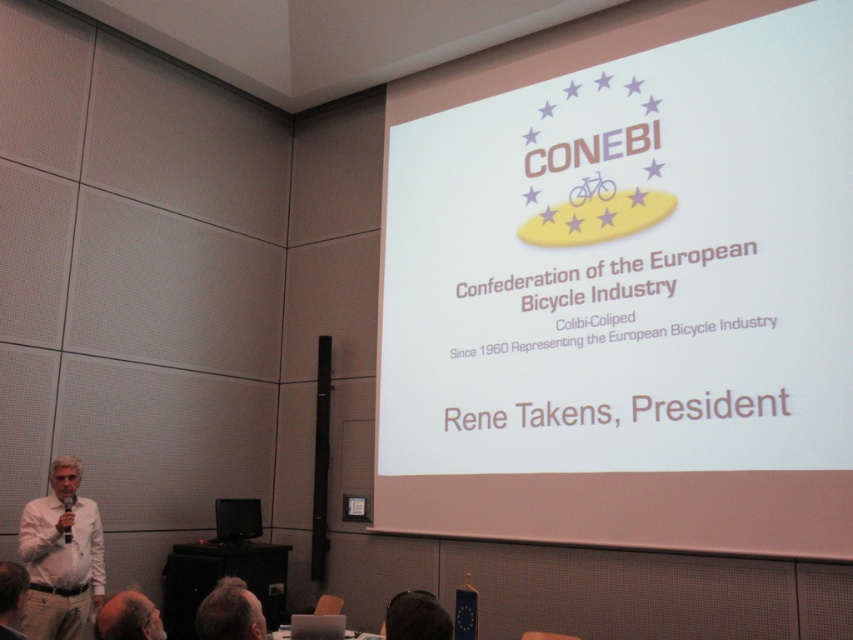
Question: Which object is the farthest from the dark brown hair at lower left?

Choices:
 (A) dark brown hair at lower center
 (B) white shirt at lower left
 (C) white paper at upper center

Answer: (C)

Question: From the image, what is the correct spatial relationship of dark brown hair at lower center in relation to light brown hair at lower left?

Choices:
 (A) below
 (B) above

Answer: (B)

Question: Which of the following is the closest to the observer?

Choices:
 (A) (57, 508)
 (B) (412, 604)
 (C) (230, 584)
 (D) (792, 554)

Answer: (B)

Question: Is white paper at upper center positioned at the back of dark brown hair at lower center?

Choices:
 (A) yes
 (B) no

Answer: (A)

Question: Which point is farther from the camera taking this photo?

Choices:
 (A) 15,579
 (B) 229,588
 (C) 392,612

Answer: (A)

Question: Where is white paper at upper center located in relation to light brown hair at lower left in the image?

Choices:
 (A) left
 (B) right

Answer: (B)